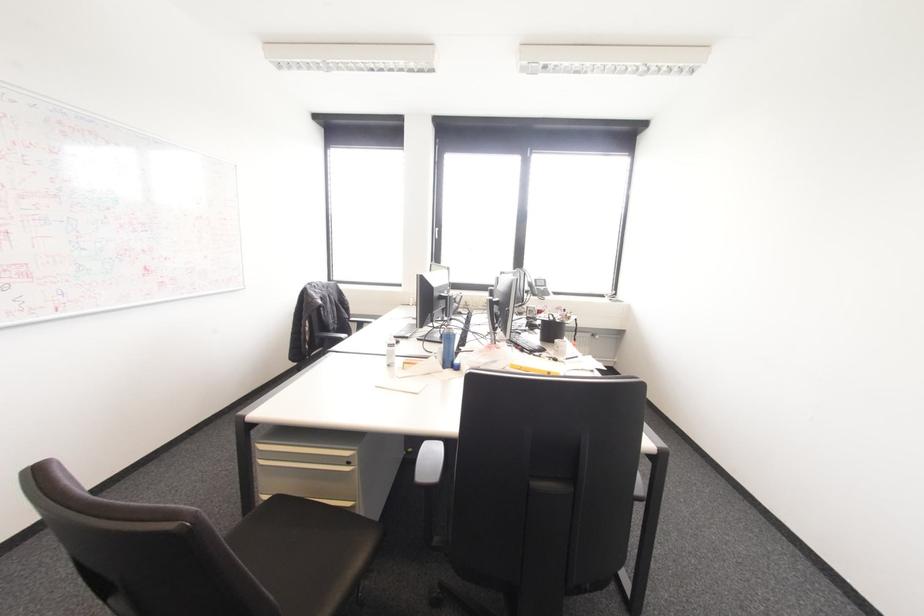
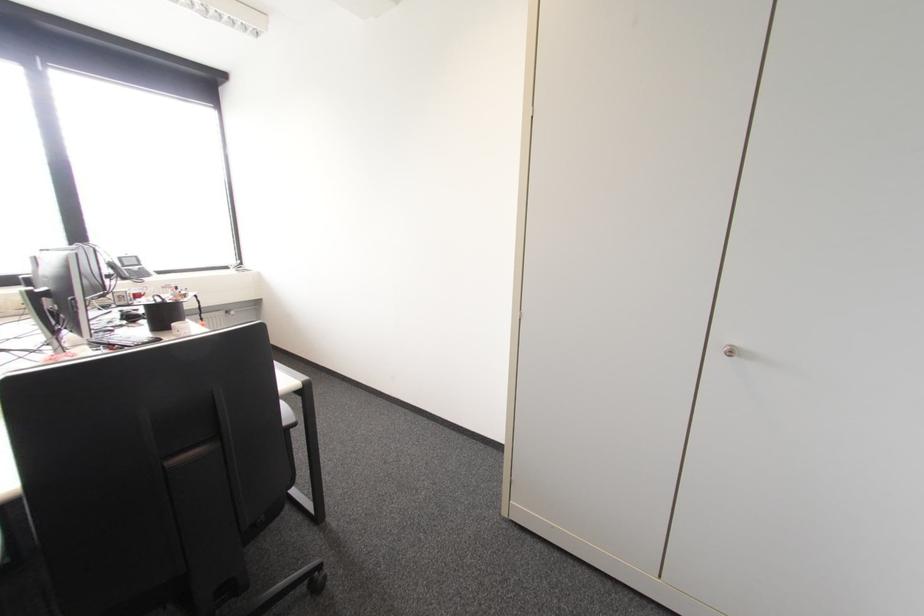
Question: How did the camera likely rotate?

Choices:
 (A) Left
 (B) Right
 (C) Up
 (D) Down

Answer: (B)